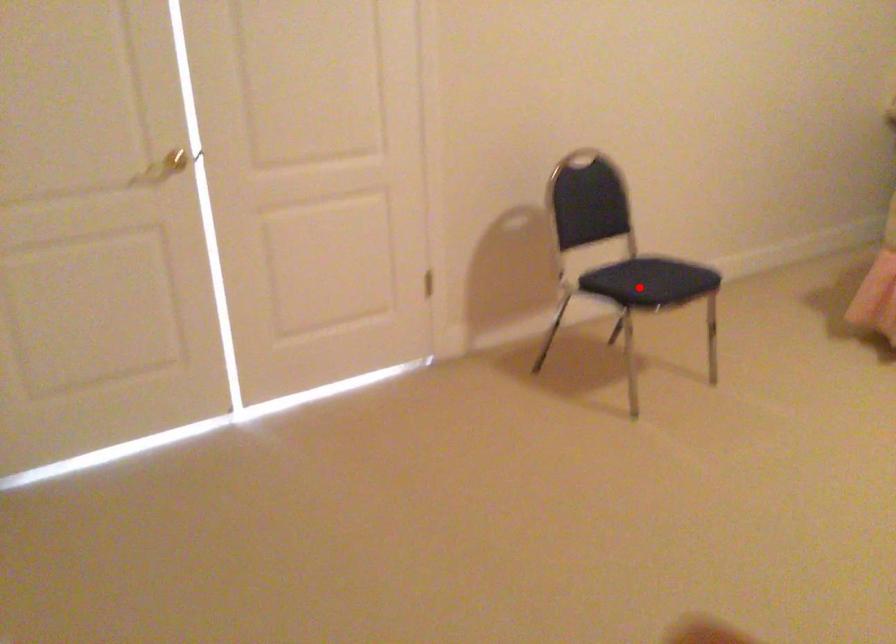
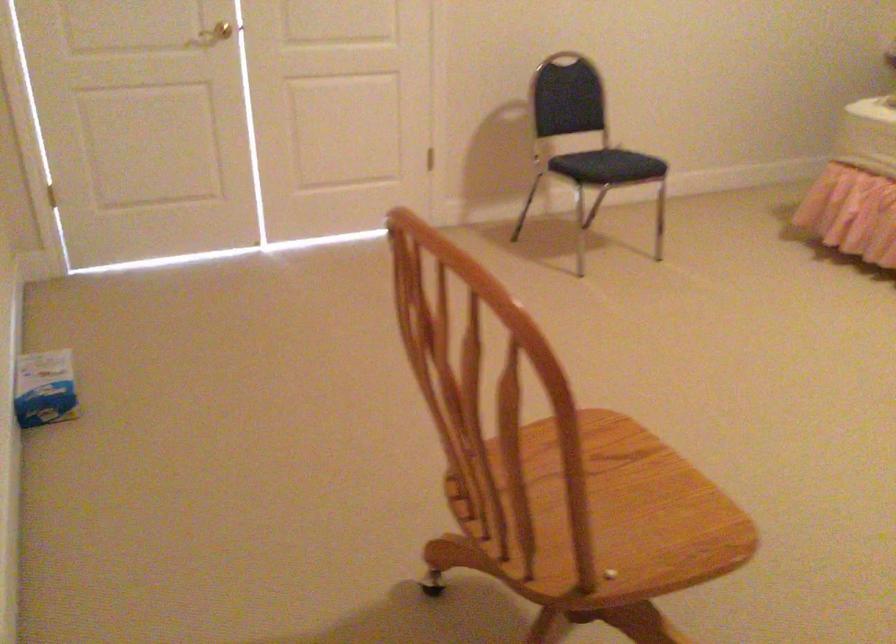
Locate, in the second image, the point that corresponds to the highlighted location in the first image.

(607, 166)